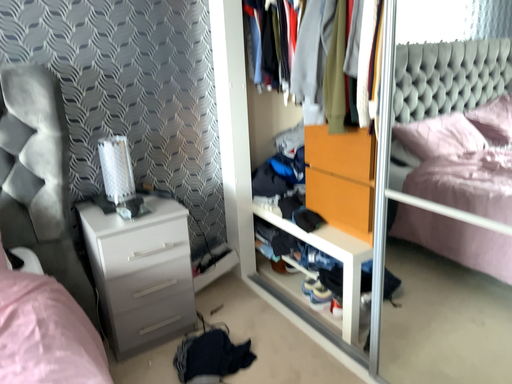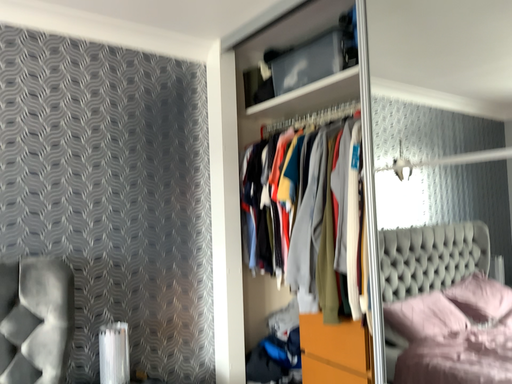
Question: How did the camera likely rotate when shooting the video?

Choices:
 (A) rotated upward
 (B) rotated downward

Answer: (A)